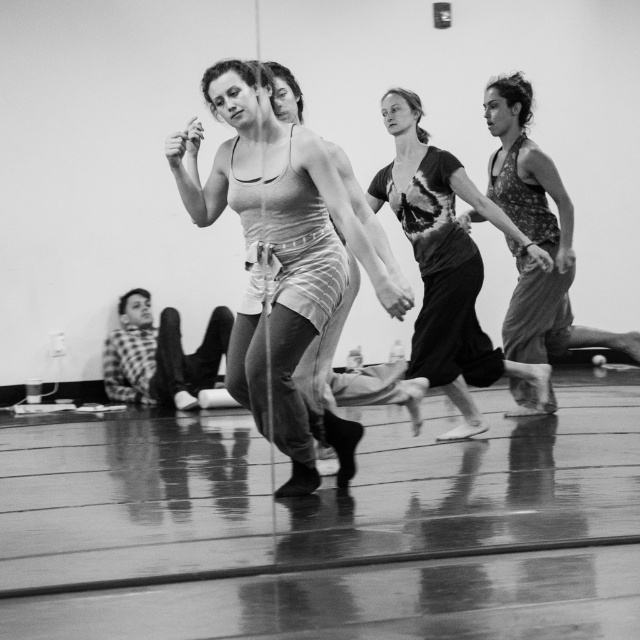
Question: Which of the following is the farthest from the observer?

Choices:
 (A) (172, 396)
 (B) (413, 248)
 (C) (196, 188)
 (D) (499, 156)

Answer: (A)

Question: Does striped fabric tank top at center appear on the left side of printed cotton dress at center?

Choices:
 (A) yes
 (B) no

Answer: (A)

Question: Does printed cotton dress at center have a greater width compared to patterned fabric tank top at right?

Choices:
 (A) yes
 (B) no

Answer: (A)

Question: Is striped fabric tank top at center thinner than patterned fabric tank top at right?

Choices:
 (A) yes
 (B) no

Answer: (A)

Question: Which of the following is the farthest from the observer?

Choices:
 (A) checkered fabric shirt at lower left
 (B) striped fabric tank top at center
 (C) printed cotton dress at center

Answer: (A)

Question: Which object is positioned closest to the patterned fabric tank top at right?

Choices:
 (A) checkered fabric shirt at lower left
 (B) striped fabric tank top at center

Answer: (B)